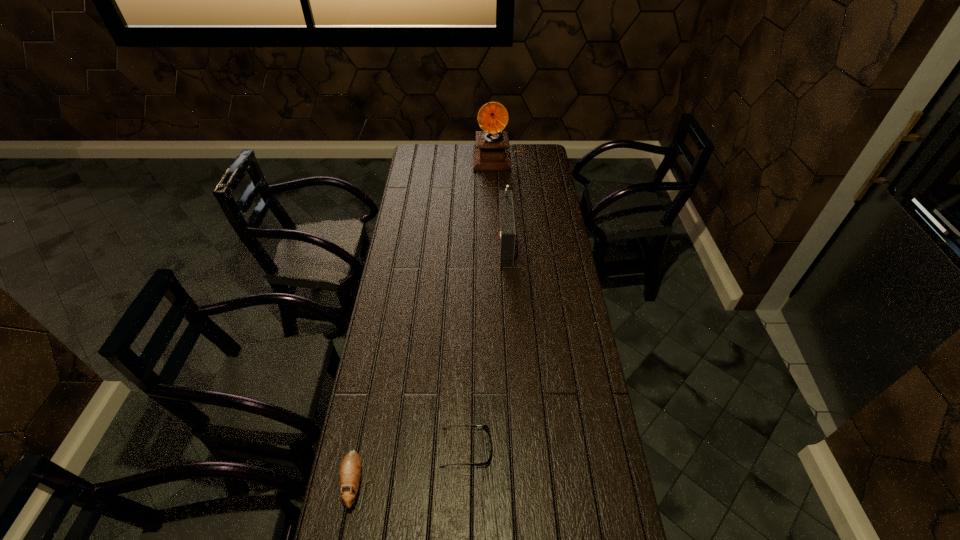
This screenshot has height=540, width=960. I want to click on free space located 0.080m on the front panel of the radio receiver, so click(479, 240).

Where is `blank area located 0.290m on the front-facing side of the sunglasses`? The width and height of the screenshot is (960, 540). blank area located 0.290m on the front-facing side of the sunglasses is located at coordinates (588, 448).

I want to click on object that is positioned at the far edge, so click(x=492, y=153).

In order to click on object present at the left edge in this screenshot , I will do `click(350, 469)`.

Find the location of a particular element. object at the right edge is located at coordinates (492, 153).

I want to click on object that is at the far right corner, so click(492, 153).

This screenshot has height=540, width=960. What are the coordinates of `free space at the far edge of the desktop` in the screenshot? It's located at pyautogui.click(x=459, y=156).

Where is `free space at the left edge of the desktop`? This screenshot has width=960, height=540. free space at the left edge of the desktop is located at coordinates (368, 525).

In order to click on blank space at the right edge in this screenshot , I will do `click(562, 291)`.

In the image, there is a desktop. What are the coordinates of `free space at the far left corner` in the screenshot? It's located at (424, 158).